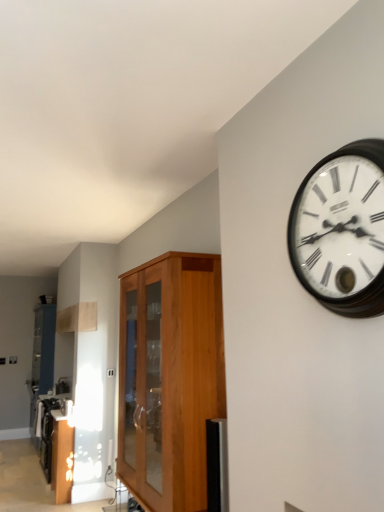
Question: Considering the relative positions of wooden cabinet at center and wooden wall clock at upper right in the image provided, is wooden cabinet at center to the left or to the right of wooden wall clock at upper right?

Choices:
 (A) right
 (B) left

Answer: (B)

Question: Looking at their shapes, would you say wooden cabinet at center is wider or thinner than wooden wall clock at upper right?

Choices:
 (A) thin
 (B) wide

Answer: (B)

Question: Based on their relative distances, which object is nearer to the wooden wall clock at upper right?

Choices:
 (A) wooden cabinet at center
 (B) metallic stainless steel toaster at lower left

Answer: (A)

Question: Estimate the real-world distances between objects in this image. Which object is farther from the wooden cabinet at center?

Choices:
 (A) wooden wall clock at upper right
 (B) metallic stainless steel toaster at lower left

Answer: (B)